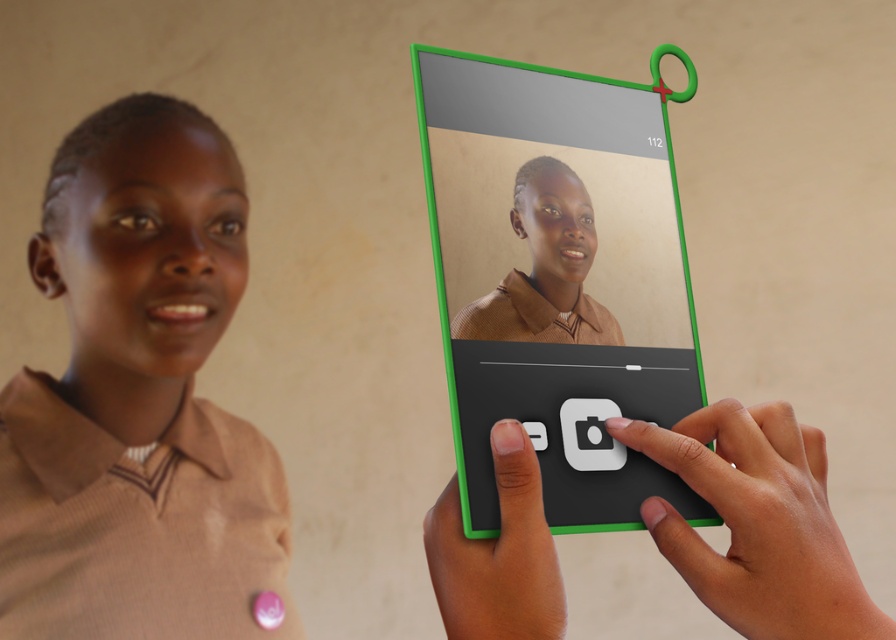
From the picture: You are a photographer trying to adjust the focus of your camera. You notice two points on your device screen at coordinates point (552, 195) and point (451, 506). Which point is closer to the camera lens?

Point (451, 506) is closer to the camera lens because it is less further away than point (552, 195) according to their positions.

You are a photographer setting up a new device. You notice the matte brown sweater at center and the matte black touchpad at center. Which object is closer to you?

The matte brown sweater at center is closer to you because the matte black touchpad at center is behind it.

You are trying to locate the point with coordinates (557,282) on the green plastic tablet at center. Based on the scene description, where would this point be located?

The point with coordinates (557,282) is located on the green plastic tablet at center.